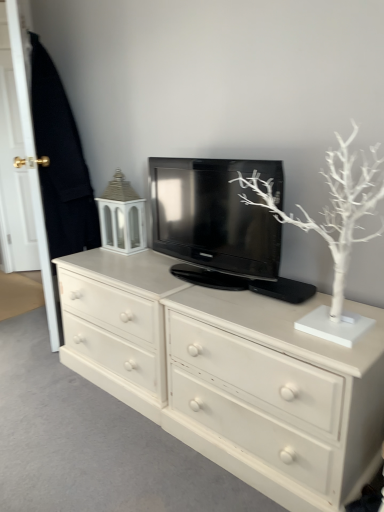
This screenshot has width=384, height=512. In order to click on black glossy television at center in this screenshot , I will do `click(214, 216)`.

The image size is (384, 512). In order to click on white painted wood chest of drawers at center in this screenshot , I will do coord(230,375).

The image size is (384, 512). Identify the location of black glossy television at center. (214, 216).

Based on their sizes in the image, would you say white wood door at left is bigger or smaller than black glossy television at center?

Clearly, white wood door at left is larger in size than black glossy television at center.

Which is nearer, (37,219) or (279,258)?

Point (37,219) appears to be farther away from the viewer than point (279,258).

Would you consider white wood door at left to be distant from black glossy television at center?

Yes.

Is white wood door at left taller than black glossy television at center?

Yes.

From a real-world perspective, between white painted wood chest of drawers at center and black glossy television at center, who is vertically lower?

In real-world perspective, white painted wood chest of drawers at center is lower.

In the scene shown: Is white painted wood chest of drawers at center completely or partially outside of black glossy television at center?

white painted wood chest of drawers at center lies outside black glossy television at center's area.

Is white painted wood chest of drawers at center not near black glossy television at center?

No, white painted wood chest of drawers at center is not far from black glossy television at center.

Between white painted wood chest of drawers at center and black glossy television at center, which one is positioned behind?

black glossy television at center is more distant.

Is white wood door at left in front of white painted wood chest of drawers at center?

That is False.

Based on the photo, would you say white wood door at left contains white painted wood chest of drawers at center?

No, white painted wood chest of drawers at center is located outside of white wood door at left.

From the image's perspective, is white wood door at left located above white painted wood chest of drawers at center?

Indeed, from the image's perspective, white wood door at left is shown above white painted wood chest of drawers at center.

Considering the relative positions of white wood door at left and white painted wood chest of drawers at center in the image provided, is white wood door at left to the left or to the right of white painted wood chest of drawers at center?

white wood door at left is positioned on white painted wood chest of drawers at center's left side.

Would you say black glossy television at center is inside or outside white painted wood chest of drawers at center?

black glossy television at center exists outside the volume of white painted wood chest of drawers at center.

Which is behind, black glossy television at center or white painted wood chest of drawers at center?

black glossy television at center is further from the camera.

From a real-world perspective, is black glossy television at center below white painted wood chest of drawers at center?

No, from a real-world perspective, black glossy television at center is not under white painted wood chest of drawers at center.

In terms of width, does black glossy television at center look wider or thinner when compared to white wood door at left?

In the image, black glossy television at center appears to be wider than white wood door at left.

Find the location of `television below the white wood door at left (from the image's perspective)`. television below the white wood door at left (from the image's perspective) is located at coordinates (214, 216).

Can you confirm if black glossy television at center is smaller than white wood door at left?

Yes.

Considering the sizes of objects white matte tree at upper right and white wood door at left in the image provided, who is bigger, white matte tree at upper right or white wood door at left?

With larger size is white wood door at left.

From a real-world perspective, which is physically below, white matte tree at upper right or white wood door at left?

white matte tree at upper right.

Is white matte tree at upper right oriented towards white wood door at left?

No, white matte tree at upper right is not turned towards white wood door at left.

How different are the orientations of white matte tree at upper right and white wood door at left in degrees?

They differ by 29.5 degrees in their facing directions.

How different are the orientations of white painted wood chest of drawers at center and white wood door at left in degrees?

59.7 degrees separate the facing orientations of white painted wood chest of drawers at center and white wood door at left.

Is white painted wood chest of drawers at center touching white wood door at left?

→ white painted wood chest of drawers at center is not next to white wood door at left, and they're not touching.

Is white painted wood chest of drawers at center looking in the opposite direction of white wood door at left?

No, white painted wood chest of drawers at center is not facing the opposite direction of white wood door at left.

This screenshot has height=512, width=384. I want to click on television below the white wood door at left (from the image's perspective), so click(x=214, y=216).

This screenshot has height=512, width=384. I want to click on television above the white painted wood chest of drawers at center (from a real-world perspective), so click(214, 216).

Based on their spatial positions, is white wood door at left or black glossy television at center further from white painted wood chest of drawers at center?

white wood door at left is positioned further to the anchor white painted wood chest of drawers at center.

Based on their spatial positions, is white painted wood chest of drawers at center or white matte tree at upper right closer to black glossy television at center?

white matte tree at upper right is positioned closer to the anchor black glossy television at center.

From the image, which object appears to be nearer to black glossy television at center, white wood door at left or white matte tree at upper right?

Based on the image, white matte tree at upper right appears to be nearer to black glossy television at center.

When comparing their distances from white painted wood chest of drawers at center, does black glossy television at center or white wood door at left seem further?

white wood door at left.

Estimate the real-world distances between objects in this image. Which object is further from white wood door at left, white painted wood chest of drawers at center or black glossy television at center?

white painted wood chest of drawers at center is positioned further to the anchor white wood door at left.

Looking at this image, based on their spatial positions, is black glossy television at center or white matte tree at upper right closer to white wood door at left?

Based on the image, black glossy television at center appears to be nearer to white wood door at left.

From the image, which object appears to be nearer to white painted wood chest of drawers at center, white matte tree at upper right or black glossy television at center?

The object closer to white painted wood chest of drawers at center is black glossy television at center.

When comparing their distances from white matte tree at upper right, does white painted wood chest of drawers at center or black glossy television at center seem further?

The object further to white matte tree at upper right is white painted wood chest of drawers at center.

You are a GUI agent. You are given a task and a screenshot of the screen. Output one action in this format:
    pyautogui.click(x=<x>, y=<y>)
    Task: Click on the television located between white wood door at left and white matte tree at upper right in the left-right direction
    The image size is (384, 512).
    Given the screenshot: What is the action you would take?
    pyautogui.click(x=214, y=216)

Locate an element on the screen. This screenshot has width=384, height=512. chest of drawers between white wood door at left and white matte tree at upper right from left to right is located at coordinates click(x=230, y=375).

You are a GUI agent. You are given a task and a screenshot of the screen. Output one action in this format:
    pyautogui.click(x=<x>, y=<y>)
    Task: Click on the television between white wood door at left and white painted wood chest of drawers at center vertically
    Image resolution: width=384 pixels, height=512 pixels.
    Given the screenshot: What is the action you would take?
    pyautogui.click(x=214, y=216)

Locate an element on the screen. This screenshot has width=384, height=512. tree between black glossy television at center and white painted wood chest of drawers at center in the vertical direction is located at coordinates pyautogui.click(x=332, y=207).